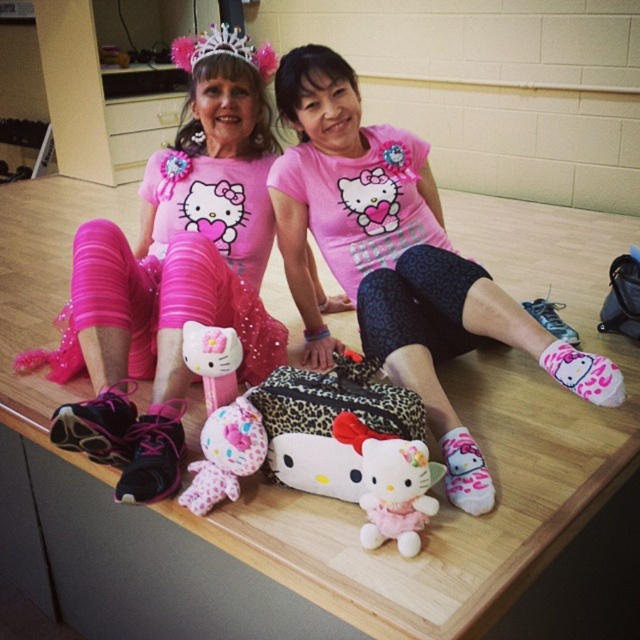
Can you confirm if pink matte hello kitty plush at center is thinner than fluffy pink plush at center?

Incorrect, pink matte hello kitty plush at center's width is not less than fluffy pink plush at center's.

Who is positioned more to the right, pink matte hello kitty plush at center or fluffy pink plush at center?

From the viewer's perspective, fluffy pink plush at center appears more on the right side.

Does point (164, 336) come closer to viewer compared to point (232, 410)?

No, (164, 336) is further to viewer.

The width and height of the screenshot is (640, 640). Identify the location of pink matte hello kitty plush at center. (172, 284).

Who is higher up, pink matte hello kitty shirt at center or fluffy pink plush at center?

pink matte hello kitty shirt at center is above.

At what (x,y) coordinates should I click in order to perform the action: click on pink matte hello kitty shirt at center. Please return your answer as a coordinate pair (x, y). This screenshot has height=640, width=640. Looking at the image, I should click on (397, 260).

At what (x,y) coordinates should I click in order to perform the action: click on pink matte hello kitty shirt at center. Please return your answer as a coordinate pair (x, y). Looking at the image, I should click on (397, 260).

Can you confirm if pink sequined dress at left is positioned above matte plastic hello kitty toy at center?

Indeed, pink sequined dress at left is positioned over matte plastic hello kitty toy at center.

Does pink sequined dress at left have a greater height compared to matte plastic hello kitty toy at center?

Correct, pink sequined dress at left is much taller as matte plastic hello kitty toy at center.

What do you see at coordinates (173, 280) in the screenshot? This screenshot has height=640, width=640. I see `pink sequined dress at left` at bounding box center [173, 280].

The image size is (640, 640). I want to click on pink sequined dress at left, so click(x=173, y=280).